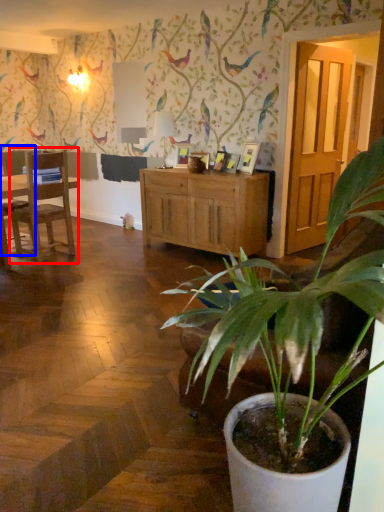
Question: Which object appears closest to the camera in this image, chair (highlighted by a red box) or chair (highlighted by a blue box)?

Choices:
 (A) chair
 (B) chair

Answer: (A)